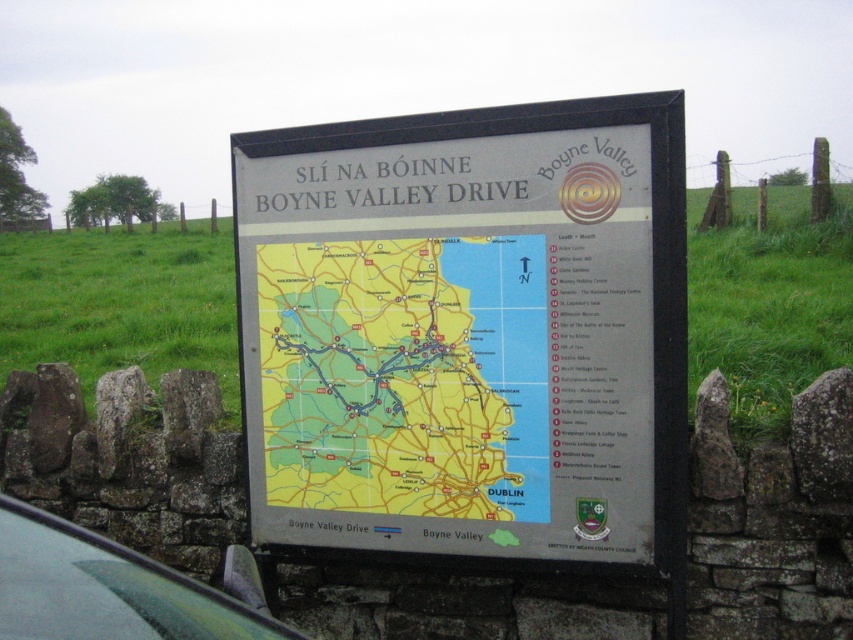
Question: Which object is farther from the camera taking this photo?

Choices:
 (A) white plastic sign at center
 (B) green matte car at lower left
 (C) yellow paper map at center

Answer: (C)

Question: Which of the following is the farthest from the observer?

Choices:
 (A) (77, 627)
 (B) (369, 252)
 (C) (563, 124)

Answer: (B)

Question: Observing the image, what is the correct spatial positioning of yellow paper map at center in reference to green matte car at lower left?

Choices:
 (A) above
 (B) below

Answer: (A)

Question: In this image, where is yellow paper map at center located relative to green matte car at lower left?

Choices:
 (A) left
 (B) right

Answer: (B)

Question: Is yellow paper map at center smaller than green matte car at lower left?

Choices:
 (A) no
 (B) yes

Answer: (A)

Question: Which of these objects is positioned closest to the yellow paper map at center?

Choices:
 (A) white plastic sign at center
 (B) green matte car at lower left

Answer: (A)